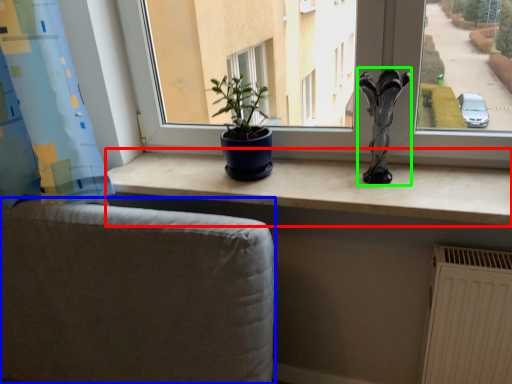
Question: Based on their relative distances, which object is farther from counter top (highlighted by a red box)? Choose from armchair (highlighted by a blue box) and sculpture (highlighted by a green box).

Choices:
 (A) armchair
 (B) sculpture

Answer: (A)